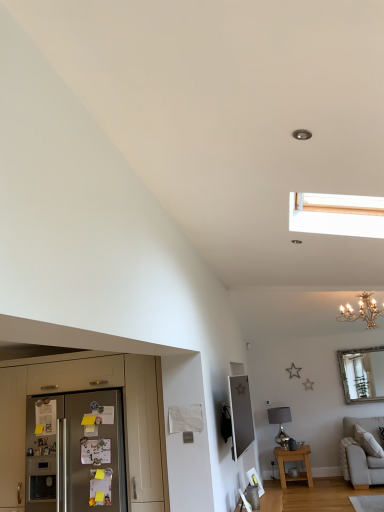
Question: Considering the positions of point (307, 476) and point (370, 361), is point (307, 476) closer or farther from the camera than point (370, 361)?

Choices:
 (A) farther
 (B) closer

Answer: (B)

Question: Considering the relative positions of beech wood side table at lower right and silver metallic mirror at upper right in the image provided, is beech wood side table at lower right to the left or to the right of silver metallic mirror at upper right?

Choices:
 (A) right
 (B) left

Answer: (B)

Question: Estimate the real-world distances between objects in this image. Which object is closer to the satin silver lamp at lower right?

Choices:
 (A) light gray fabric couch at lower right
 (B) silver metallic mirror at upper right
 (C) beech wood side table at lower right
 (D) satin silver refrigerator at lower left
 (E) stainless steel refrigerator at lower left

Answer: (C)

Question: Considering the real-world distances, which object is closest to the satin silver lamp at lower right?

Choices:
 (A) gold metallic chandelier at upper right
 (B) satin silver refrigerator at lower left
 (C) beech wood side table at lower right
 (D) light gray fabric couch at lower right
 (E) stainless steel refrigerator at lower left

Answer: (C)